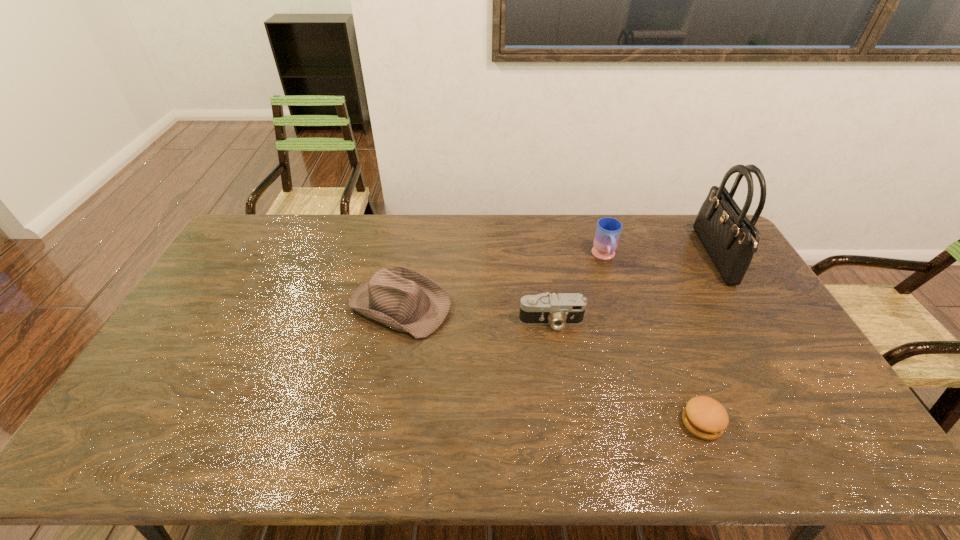
The width and height of the screenshot is (960, 540). Identify the location of vacant space at the far edge. (618, 218).

Find the location of a particular element. Image resolution: width=960 pixels, height=540 pixels. vacant space at the near edge of the desktop is located at coordinates (182, 449).

The height and width of the screenshot is (540, 960). I want to click on vacant space at the left edge, so click(235, 276).

In the image, there is a desktop. Identify the location of vacant space at the right edge. (776, 361).

This screenshot has height=540, width=960. What are the coordinates of `vacant space at the near left corner of the desktop` in the screenshot? It's located at (126, 459).

Where is `empty location between the leftmost object and the second shortest object`? empty location between the leftmost object and the second shortest object is located at coordinates (476, 313).

At what (x,y) coordinates should I click in order to perform the action: click on vacant area that lies between the fourth tallest object and the shortest object. Please return your answer as a coordinate pair (x, y). The height and width of the screenshot is (540, 960). Looking at the image, I should click on (627, 372).

Where is `vacant point located between the third object from right to left and the fedora`? vacant point located between the third object from right to left and the fedora is located at coordinates (502, 281).

Where is `free spot between the leftmost object and the shortest object`? Image resolution: width=960 pixels, height=540 pixels. free spot between the leftmost object and the shortest object is located at coordinates (551, 364).

Find the location of `vacant space in between the leftmost object and the fourth object from right to left`. vacant space in between the leftmost object and the fourth object from right to left is located at coordinates (476, 313).